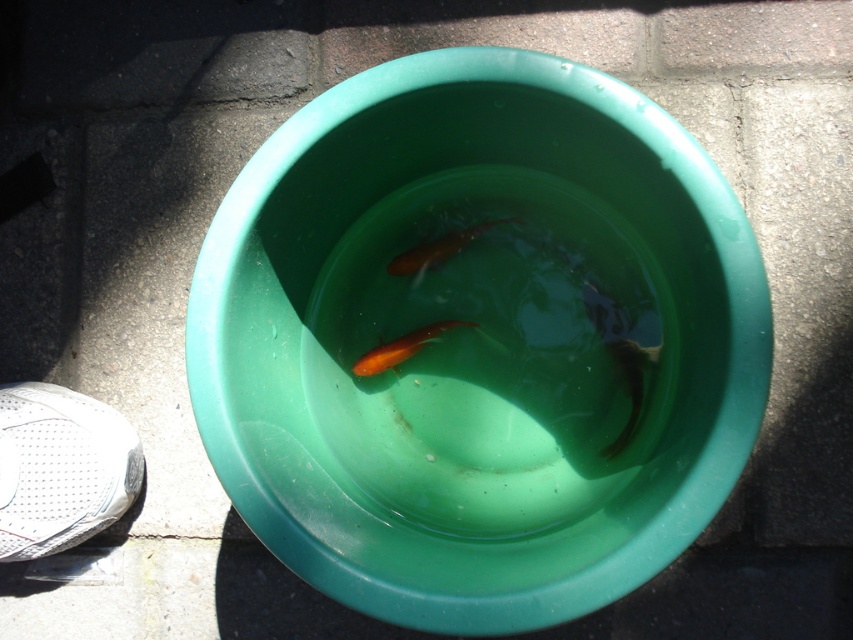
Question: Which point appears farthest from the camera in this image?

Choices:
 (A) (440, 328)
 (B) (465, 230)
 (C) (379, 380)

Answer: (B)

Question: Which object is farther from the camera taking this photo?

Choices:
 (A) green plastic bowl at center
 (B) orange glossy goldfish at center
 (C) orange glossy fish at center

Answer: (C)

Question: Can you confirm if green plastic bowl at center is positioned below orange glossy goldfish at center?

Choices:
 (A) yes
 (B) no

Answer: (B)

Question: Can you confirm if green plastic bowl at center is positioned to the right of orange glossy goldfish at center?

Choices:
 (A) yes
 (B) no

Answer: (A)

Question: Which of these objects is positioned closest to the orange glossy fish at center?

Choices:
 (A) green plastic bowl at center
 (B) orange glossy goldfish at center

Answer: (B)

Question: From the image, what is the correct spatial relationship of green plastic bowl at center in relation to orange glossy goldfish at center?

Choices:
 (A) below
 (B) above

Answer: (B)